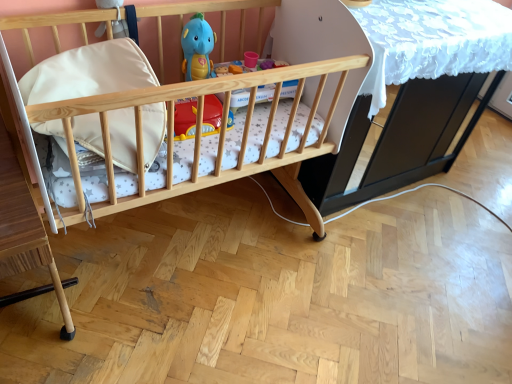
This screenshot has height=384, width=512. What are the coordinates of `free spot to the right of natural wood crib at center` in the screenshot? It's located at (350, 301).